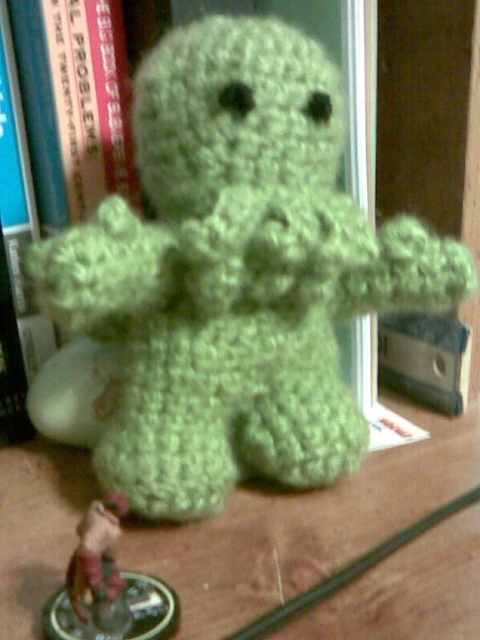
You are organizing a toy store shelf and need to arrange the green yarn stuffed toy at center and the metallic red figurine at lower left. Based on their sizes, which one should you place on the higher shelf to ensure stability?

The green yarn stuffed toy at center has a greater height compared to the metallic red figurine at lower left, so it should be placed on the higher shelf to ensure stability.

You are a photographer trying to capture the crocheted ghost figure. You notice two points marked in the scene. The first point is at coordinate point (120,122) and the second is at coordinate point (83,620). Which point is closer to the camera?

Point (120,122) is further to the camera than point (83,620), so the second point is closer to the camera.

You are organizing a toy store shelf and need to place the metallic red figurine at lower left and the green yarn stuffed toy at center. The shelf has a height limit of 15 cm. Can both items be placed on the shelf without exceeding the height limit?

The metallic red figurine at lower left is behind green yarn stuffed toy at center, but their individual heights are not provided. Without knowing their specific heights, it is impossible to determine if they can fit within the 15 cm height limit.